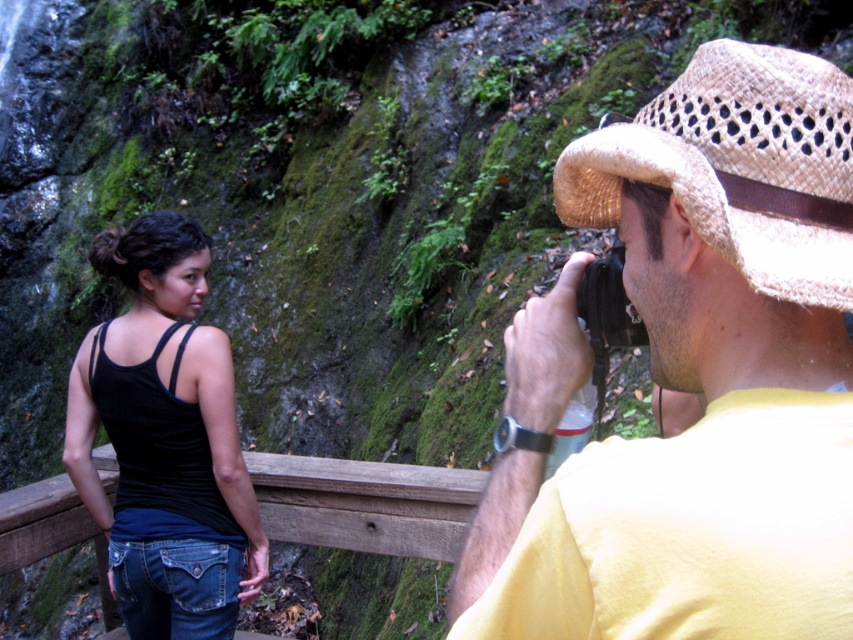
Question: Which point is farther to the camera?

Choices:
 (A) black matte tank top at center
 (B) woven straw cowboy hat at upper right

Answer: (A)

Question: Which of the following is the farthest from the observer?

Choices:
 (A) black matte tank top at center
 (B) beige straw hat at upper right
 (C) woven straw cowboy hat at upper right

Answer: (A)

Question: Which point is farther to the camera?

Choices:
 (A) (764, 45)
 (B) (173, 451)
 (C) (757, 333)

Answer: (B)

Question: Is beige straw hat at upper right to the right of woven straw cowboy hat at upper right from the viewer's perspective?

Choices:
 (A) yes
 (B) no

Answer: (B)

Question: Is the position of black matte tank top at center more distant than that of woven straw cowboy hat at upper right?

Choices:
 (A) no
 (B) yes

Answer: (B)

Question: Is black matte tank top at center to the left of woven straw cowboy hat at upper right from the viewer's perspective?

Choices:
 (A) yes
 (B) no

Answer: (A)